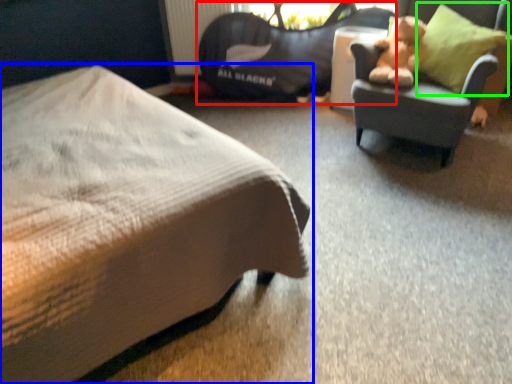
Question: Which object is the farthest from bean bag chair (highlighted by a red box)? Choose among these: bed (highlighted by a blue box) or throw pillow (highlighted by a green box).

Choices:
 (A) bed
 (B) throw pillow

Answer: (A)